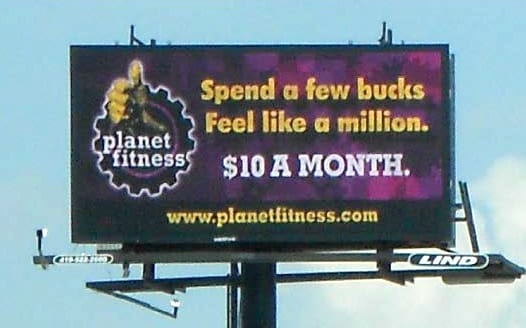
At what (x,y) coordinates should I click in order to perform the action: click on light. Please return your answer as a coordinate pair (x, y). This screenshot has height=328, width=526. Looking at the image, I should click on (43, 228).